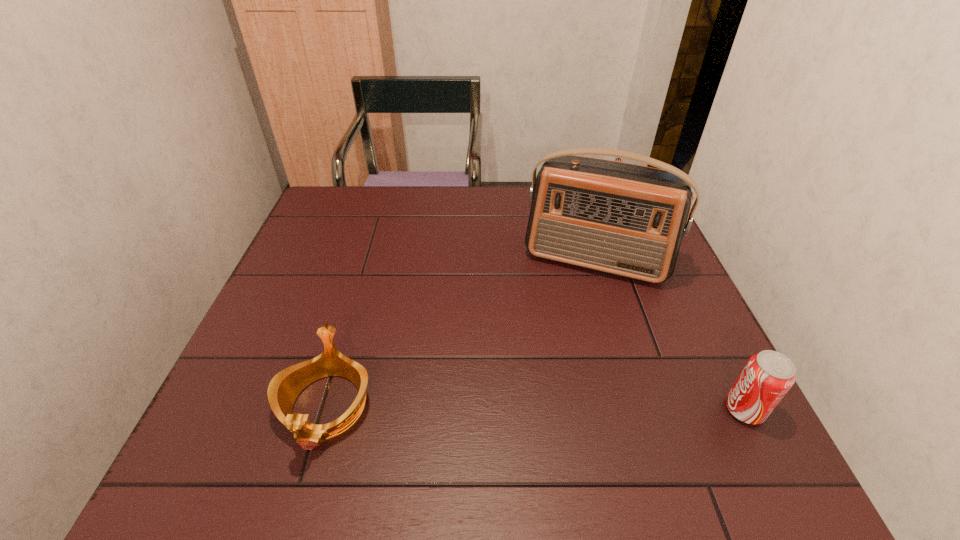
I want to click on free spot between the soda can and the leftmost object, so click(535, 408).

The height and width of the screenshot is (540, 960). I want to click on empty space that is in between the tiara and the soda can, so click(x=535, y=408).

Where is `vacant space that is in between the radio receiver and the soda can`? The height and width of the screenshot is (540, 960). vacant space that is in between the radio receiver and the soda can is located at coordinates (670, 335).

You are a GUI agent. You are given a task and a screenshot of the screen. Output one action in this format:
    pyautogui.click(x=<x>, y=<y>)
    Task: Click on the vacant space that's between the soda can and the third nearest object
    
    Given the screenshot: What is the action you would take?
    pyautogui.click(x=670, y=335)

Where is `unoccupied area between the soda can and the tallest object`? unoccupied area between the soda can and the tallest object is located at coordinates (670, 335).

Locate an element on the screen. The height and width of the screenshot is (540, 960). vacant area that lies between the soda can and the puncher is located at coordinates (678, 303).

The width and height of the screenshot is (960, 540). In order to click on free point between the third nearest object and the leftmost object in this screenshot , I will do [461, 334].

Locate an element on the screen. Image resolution: width=960 pixels, height=540 pixels. vacant region between the puncher and the leftmost object is located at coordinates coord(468,302).

What are the coordinates of `the closest object to the soda can` in the screenshot? It's located at (625, 219).

Locate an element on the screen. the closest object relative to the tiara is located at coordinates (625, 219).